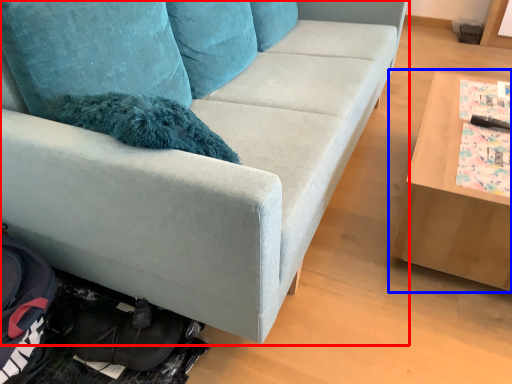
Question: Which object is closer to the camera taking this photo, studio couch (highlighted by a red box) or table (highlighted by a blue box)?

Choices:
 (A) studio couch
 (B) table

Answer: (A)